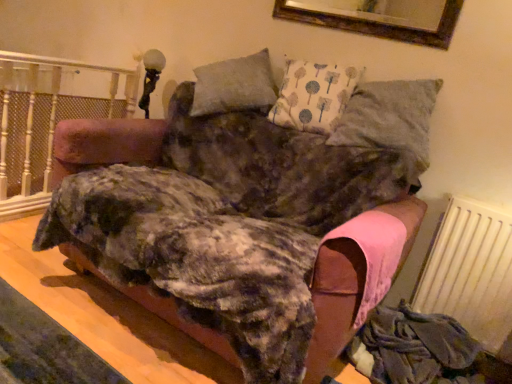
Question: Is velvet pink sofa at center next to white textured radiator at lower right and touching it?

Choices:
 (A) yes
 (B) no

Answer: (B)

Question: From a real-world perspective, does velvet pink sofa at center stand above white textured radiator at lower right?

Choices:
 (A) yes
 (B) no

Answer: (A)

Question: Considering the relative sizes of velvet pink sofa at center and white textured radiator at lower right in the image provided, is velvet pink sofa at center bigger than white textured radiator at lower right?

Choices:
 (A) yes
 (B) no

Answer: (A)

Question: Is velvet pink sofa at center smaller than white textured radiator at lower right?

Choices:
 (A) no
 (B) yes

Answer: (A)

Question: Is velvet pink sofa at center behind white textured radiator at lower right?

Choices:
 (A) yes
 (B) no

Answer: (B)

Question: Does velvet pink sofa at center lie in front of white textured radiator at lower right?

Choices:
 (A) yes
 (B) no

Answer: (A)

Question: Does white painted wood at left have a lesser height compared to textured gray pillow at upper right?

Choices:
 (A) yes
 (B) no

Answer: (B)

Question: Could you tell me if white painted wood at left is facing textured gray pillow at upper right?

Choices:
 (A) yes
 (B) no

Answer: (B)

Question: From a real-world perspective, is white painted wood at left physically above textured gray pillow at upper right?

Choices:
 (A) yes
 (B) no

Answer: (B)

Question: Is white painted wood at left at the left side of textured gray pillow at upper right?

Choices:
 (A) no
 (B) yes

Answer: (B)

Question: Is white painted wood at left positioned with its back to textured gray pillow at upper right?

Choices:
 (A) no
 (B) yes

Answer: (B)

Question: Is white painted wood at left in front of textured gray pillow at upper right?

Choices:
 (A) yes
 (B) no

Answer: (B)

Question: Would you say white painted wood at left contains velvet pink sofa at center?

Choices:
 (A) no
 (B) yes

Answer: (A)